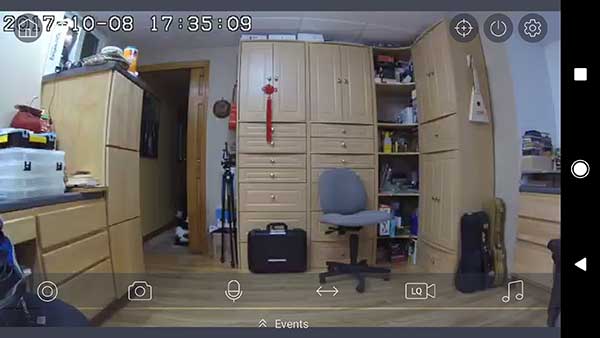
Locate an element on the screen. The width and height of the screenshot is (600, 338). white plastic storage is located at coordinates (36, 176).